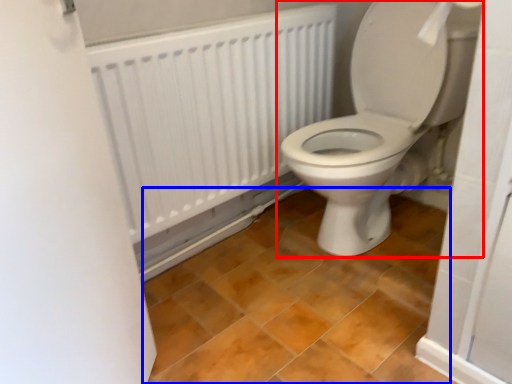
Question: Which object appears farthest to the camera in this image, toilet (highlighted by a red box) or ceramic tile (highlighted by a blue box)?

Choices:
 (A) toilet
 (B) ceramic tile

Answer: (A)